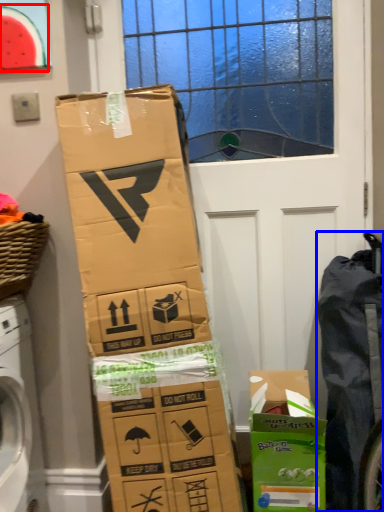
Question: Which point is closer to the camera, watermelon (highlighted by a red box) or waste (highlighted by a blue box)?

Choices:
 (A) watermelon
 (B) waste

Answer: (B)